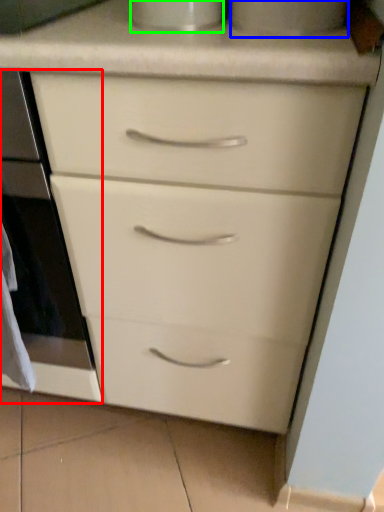
Question: Based on their relative distances, which object is nearer to oven (highlighted by a red box)? Choose from appliance (highlighted by a blue box) and appliance (highlighted by a green box).

Choices:
 (A) appliance
 (B) appliance

Answer: (B)